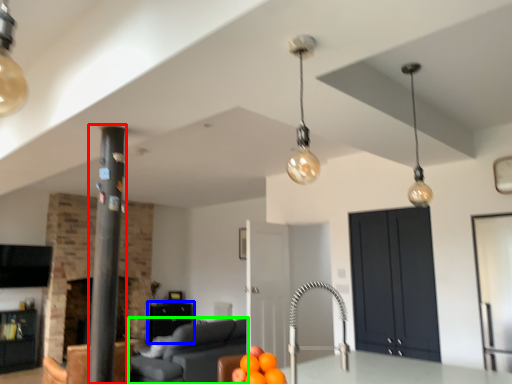
Question: Which object is the farthest from pillar (highlighted by a red box)? Choose among these: cabinetry (highlighted by a blue box) or furniture (highlighted by a green box).

Choices:
 (A) cabinetry
 (B) furniture

Answer: (A)